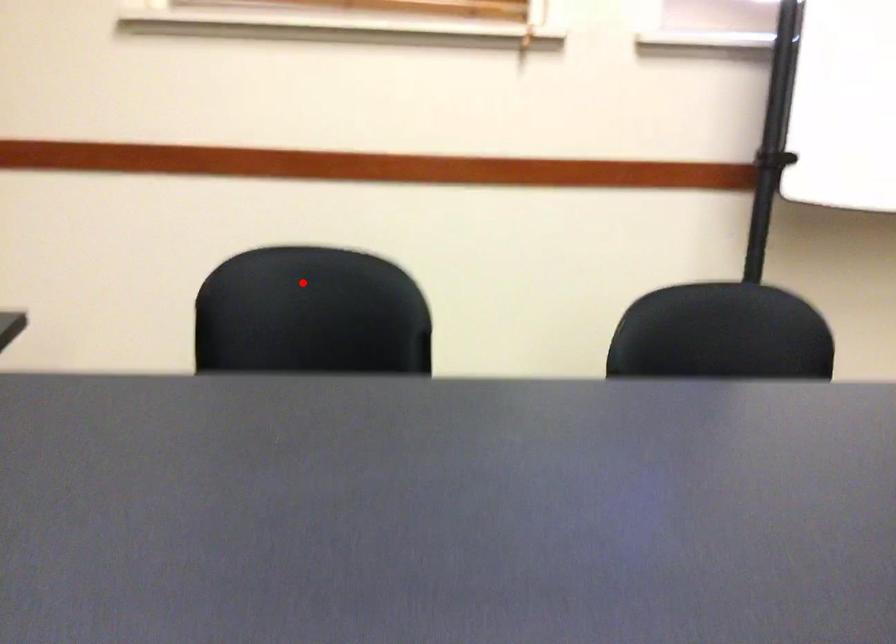
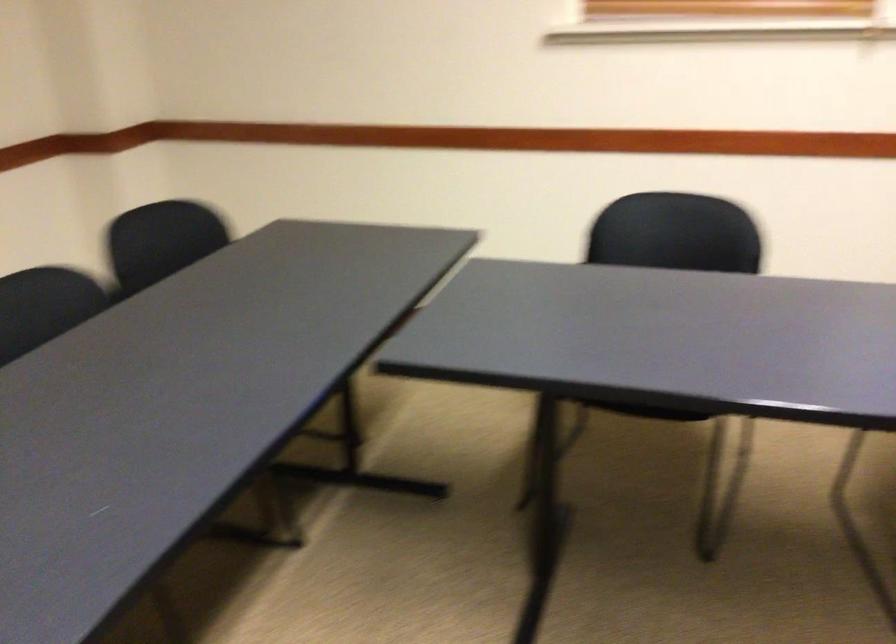
Find the pixel in the second image that matches the highlighted location in the first image.

(672, 223)